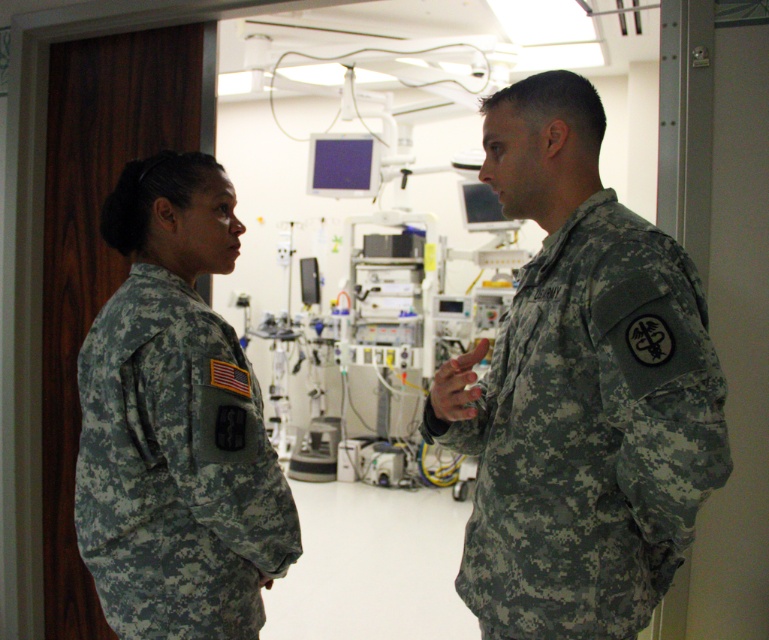
Question: Which of the following is the closest to the observer?

Choices:
 (A) camouflage uniform at left
 (B) camouflage uniform at right
 (C) camouflage fabric monitor at center

Answer: (B)

Question: Observing the image, what is the correct spatial positioning of camouflage uniform at right in reference to camouflage fabric monitor at center?

Choices:
 (A) below
 (B) above

Answer: (A)

Question: Which point is closer to the camera taking this photo?

Choices:
 (A) (205, 490)
 (B) (634, 572)

Answer: (B)

Question: Can you confirm if camouflage uniform at left is positioned below camouflage fabric monitor at center?

Choices:
 (A) yes
 (B) no

Answer: (A)

Question: Where is camouflage uniform at right located in relation to camouflage fabric monitor at center in the image?

Choices:
 (A) above
 (B) below

Answer: (B)

Question: Which point is closer to the camera?

Choices:
 (A) (241, 449)
 (B) (321, 298)
 (C) (598, 208)

Answer: (C)